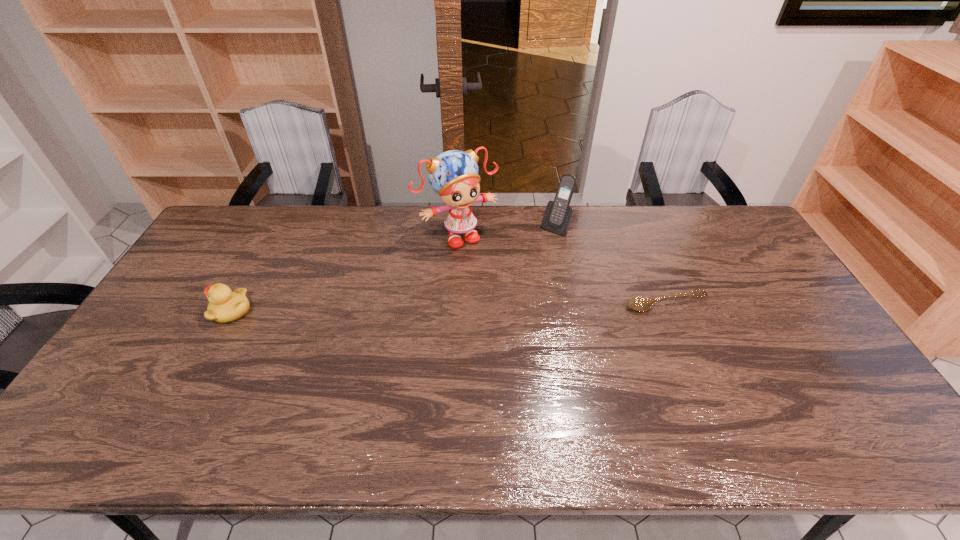
I want to click on unoccupied position between the third tallest object and the doll, so click(345, 273).

Find the location of a particular element. The width and height of the screenshot is (960, 540). vacant point located between the ladle and the duckling is located at coordinates (449, 307).

You are a GUI agent. You are given a task and a screenshot of the screen. Output one action in this format:
    pyautogui.click(x=<x>, y=<y>)
    Task: Click on the vacant area that lies between the third object from left to right and the third object from right to left
    Image resolution: width=960 pixels, height=540 pixels.
    Given the screenshot: What is the action you would take?
    pyautogui.click(x=507, y=231)

Locate an element on the screen. free space that is in between the second object from right to left and the ladle is located at coordinates (611, 265).

The height and width of the screenshot is (540, 960). In order to click on free space between the shortest object and the third object from right to left in this screenshot , I will do `click(562, 269)`.

Where is `object that can be found as the third closest to the tallest object`? Image resolution: width=960 pixels, height=540 pixels. object that can be found as the third closest to the tallest object is located at coordinates (224, 306).

At what (x,y) coordinates should I click in order to perform the action: click on object identified as the second closest to the tallest object. Please return your answer as a coordinate pair (x, y). Looking at the image, I should click on (636, 303).

Find the location of a particular element. The height and width of the screenshot is (540, 960). blank space that satisfies the following two spatial constraints: 1. on the front side of the shortest object; 2. on the right side of the third object from left to right is located at coordinates (571, 304).

Identify the location of free location that satisfies the following two spatial constraints: 1. on the back side of the second object from right to left; 2. on the left side of the doll. The image size is (960, 540). (458, 227).